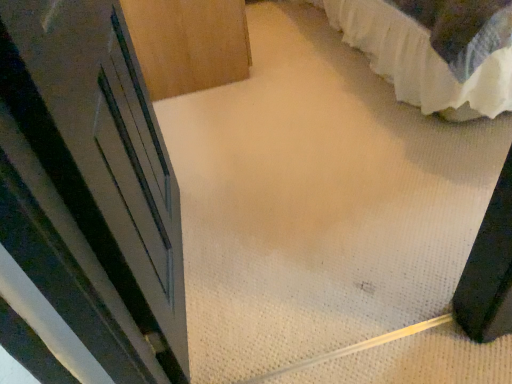
Locate an element on the screen. The height and width of the screenshot is (384, 512). empty space that is to the right of metallic gray door at left is located at coordinates (305, 238).